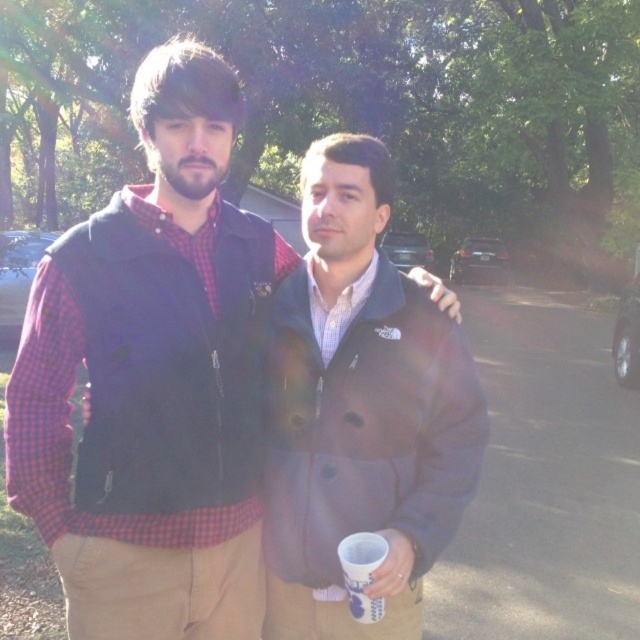
You are a photographer trying to capture a closeup of the brushed metal vest at upper left. Based on the scene description, where should you position your camera relative to the two people?

The brushed metal vest at upper left is located at point [154,380], so you should position your camera closer to the upper left area to capture the brushed metal vest at upper left effectively.

You are a photographer setting up a tripod to take a portrait of both the brown woolen jacket at center and the white paper cup at lower center. The tripod requires that the subject must be at least 1.5 meters tall to be in focus. Can both subjects be in focus simultaneously?

The brown woolen jacket at center is much taller than the white paper cup at lower center, but the description does not provide specific height measurements. Therefore, it is uncertain if both subjects meet the tripod requirement of being at least 1.5 meters tall to be in focus simultaneously.

You are standing in the park and want to place a small flag at the point closer to you between the two points marked as point 1 at (131, 588) and point 2 at (369, 582). Which point should you choose?

You should choose point 1 at (131, 588) because it is closer to you than point 2 at (369, 582).